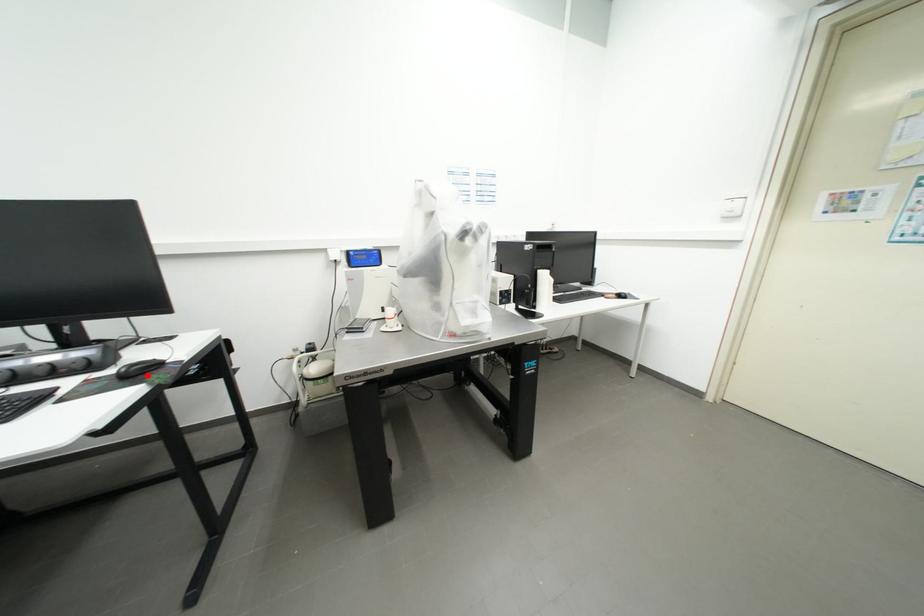
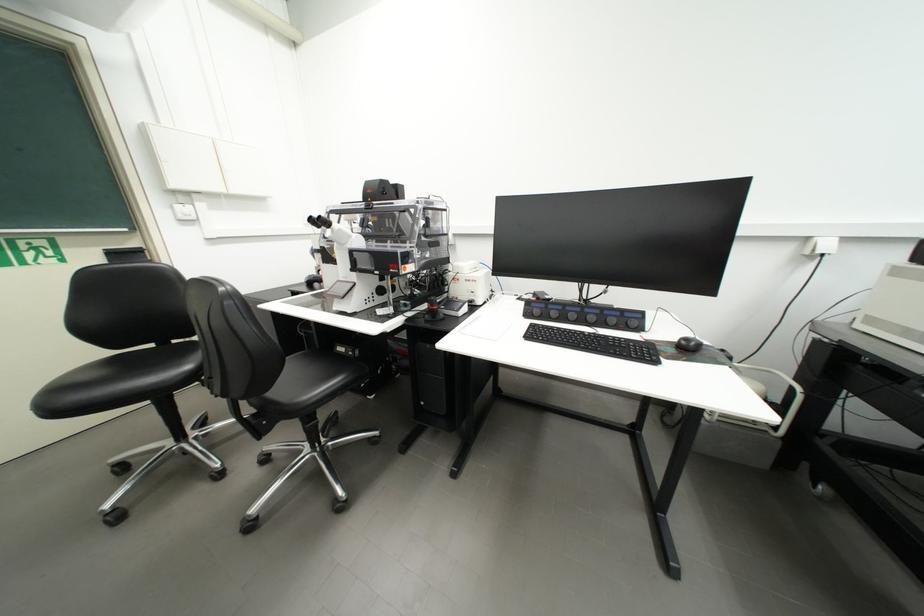
Where in the second image is the point corresponding to the highlighted location from the first image?

(697, 351)